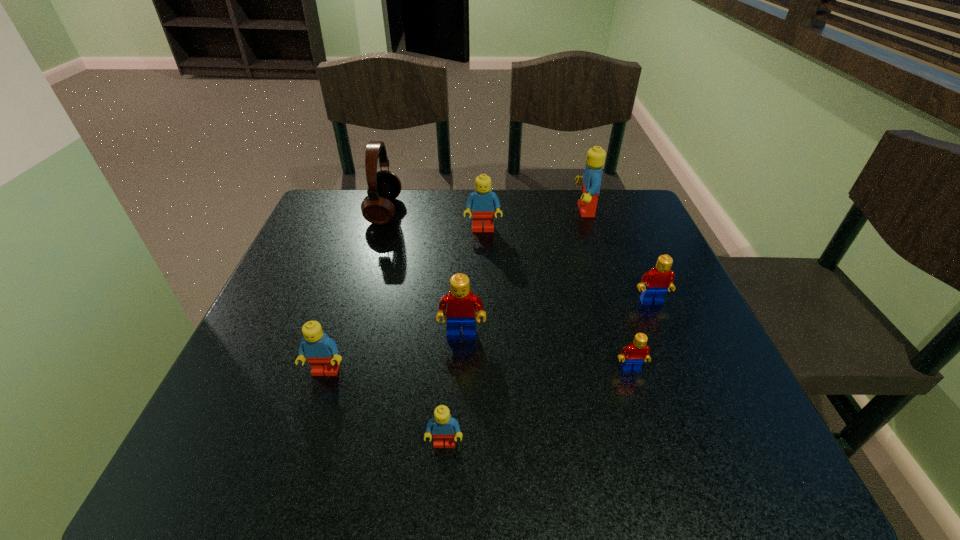
Find the location of `headset`. headset is located at coordinates (384, 186).

Find the location of a particular element. The image size is (960, 540). the tallest Lego is located at coordinates (591, 180).

Find the location of a particular element. The height and width of the screenshot is (540, 960). the farthest Lego is located at coordinates (591, 180).

The height and width of the screenshot is (540, 960). I want to click on the second biggest blue Lego, so click(482, 201).

I want to click on the third nearest blue Lego, so (x=482, y=201).

Where is `the leftmost red Lego`? Image resolution: width=960 pixels, height=540 pixels. the leftmost red Lego is located at coordinates (460, 305).

You are a GUI agent. You are given a task and a screenshot of the screen. Output one action in this format:
    pyautogui.click(x=<x>, y=<y>)
    Task: Click on the biggest red Lego
    The image size is (960, 540).
    Given the screenshot: What is the action you would take?
    pyautogui.click(x=460, y=305)

You are a GUI agent. You are given a task and a screenshot of the screen. Output one action in this format:
    pyautogui.click(x=<x>, y=<y>)
    Task: Click on the leftmost blue Lego
    The height and width of the screenshot is (540, 960).
    Given the screenshot: What is the action you would take?
    (x=321, y=351)

Where is `the leftmost Lego`? the leftmost Lego is located at coordinates (321, 351).

Where is `the fifth nearest object`? the fifth nearest object is located at coordinates (660, 278).